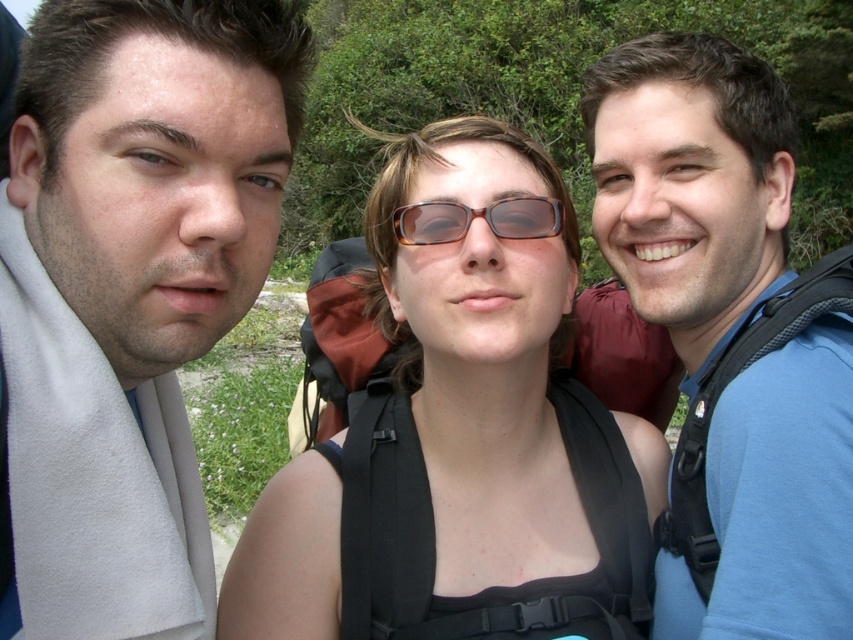
You are standing at the origin point in the image. A matte black backpack at center is located at point [483,356]. If you want to move towards the backpack, which direction should you move in terms of coordinates?

The matte black backpack at center is located at coordinates point [483,356], so you should move towards those coordinates to reach it.

You are a hiker who needs to access your water bottle located in the blue fabric backpack at center. The tortoiseshell plastic glasses at center are blocking your direct line of sight to the backpack. Can you reach the backpack without moving the glasses?

The blue fabric backpack at center is below the tortoiseshell plastic glasses at center, so you can reach it by moving your hand under the glasses.